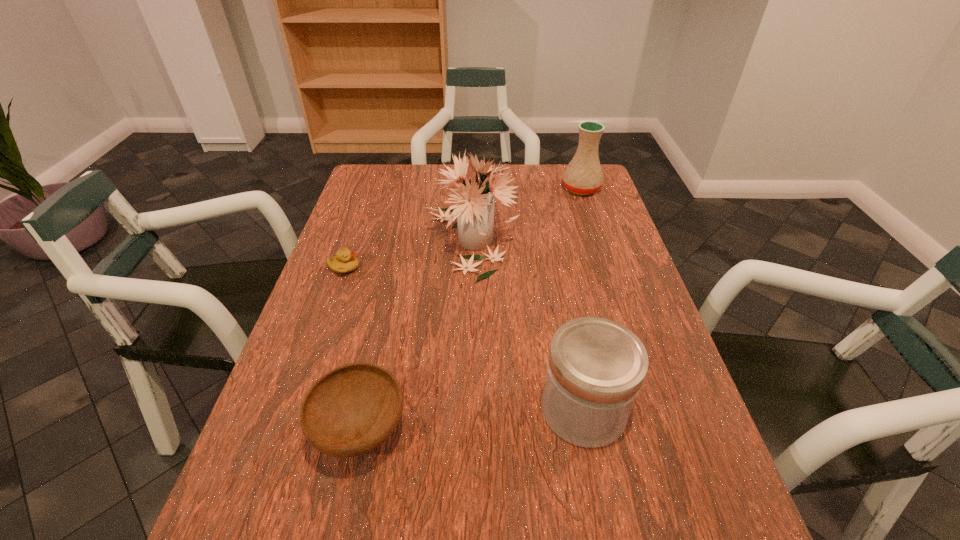
Locate an element on the screen. This screenshot has height=540, width=960. vacant region that satisfies the following two spatial constraints: 1. on the back side of the bowl; 2. on the right side of the third tallest object is located at coordinates (366, 409).